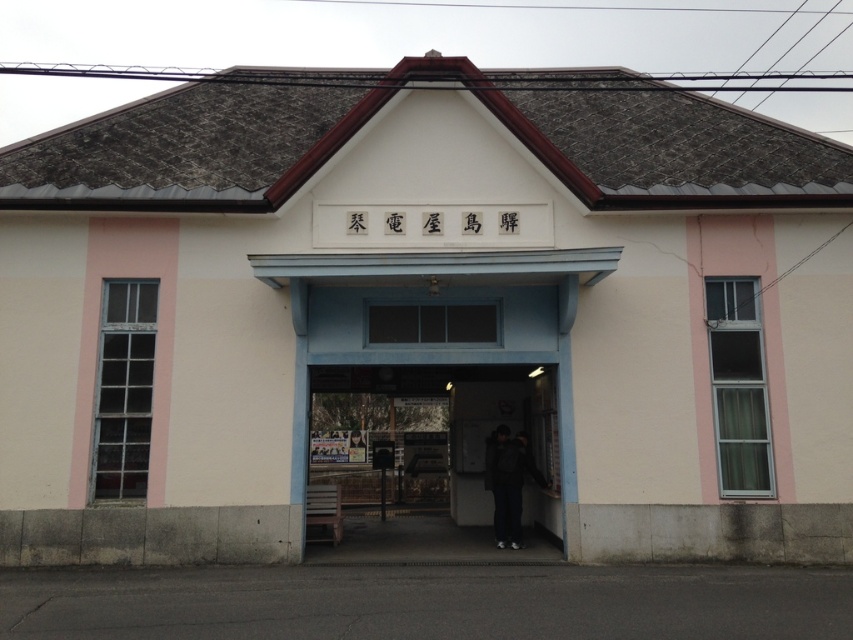
Question: Which point is closer to the camera taking this photo?

Choices:
 (A) (506, 524)
 (B) (399, 388)

Answer: (A)

Question: Which object is the farthest from the dark gray concrete entrance at center?

Choices:
 (A) matte concrete entrance at center
 (B) dark gray jacket at center

Answer: (A)

Question: Does matte concrete entrance at center appear on the left side of dark gray concrete entrance at center?

Choices:
 (A) no
 (B) yes

Answer: (B)

Question: Where is matte concrete entrance at center located in relation to dark gray jacket at center in the image?

Choices:
 (A) above
 (B) below

Answer: (A)

Question: Is the position of matte concrete entrance at center less distant than that of dark gray jacket at center?

Choices:
 (A) no
 (B) yes

Answer: (A)

Question: Which object is closer to the camera taking this photo?

Choices:
 (A) matte concrete entrance at center
 (B) dark gray jacket at center
 (C) dark gray concrete entrance at center

Answer: (B)